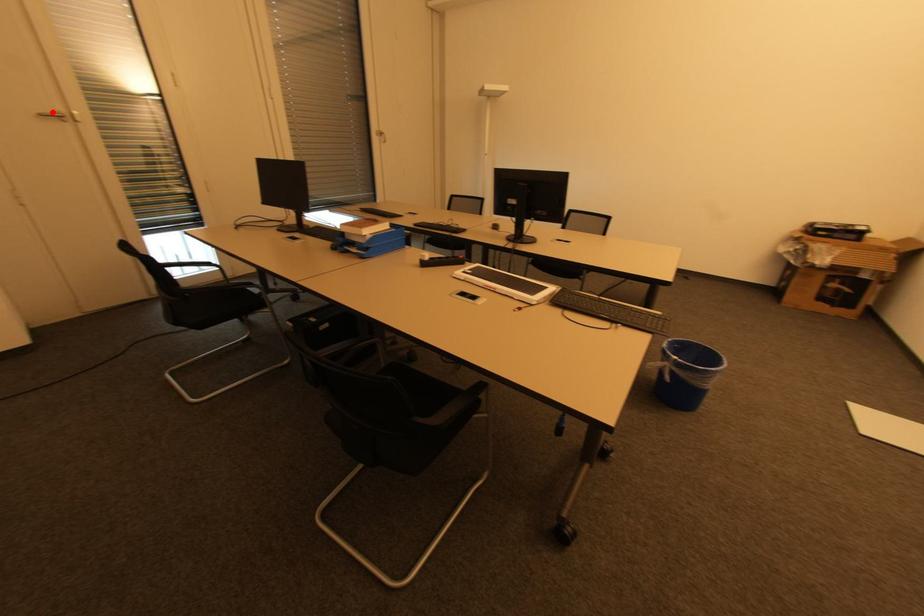
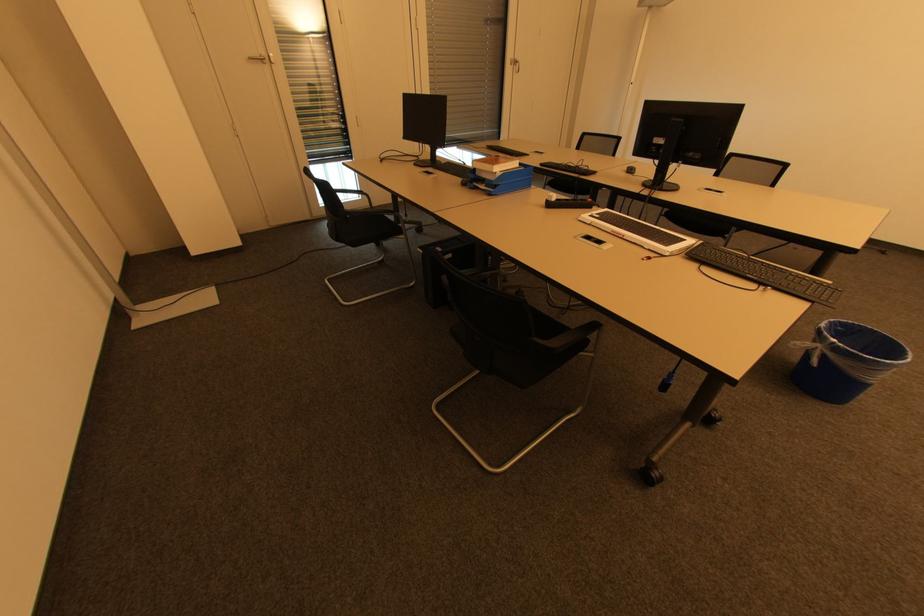
Where in the second image is the point corresponding to the highlighted location from the first image?

(258, 55)